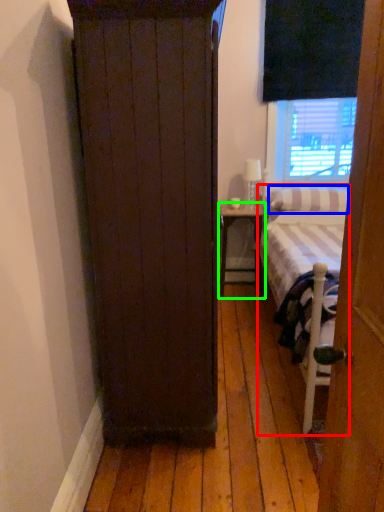
Question: Which is nearer to the bed (highlighted by a red box)? pillow (highlighted by a blue box) or nightstand (highlighted by a green box).

Choices:
 (A) pillow
 (B) nightstand

Answer: (A)